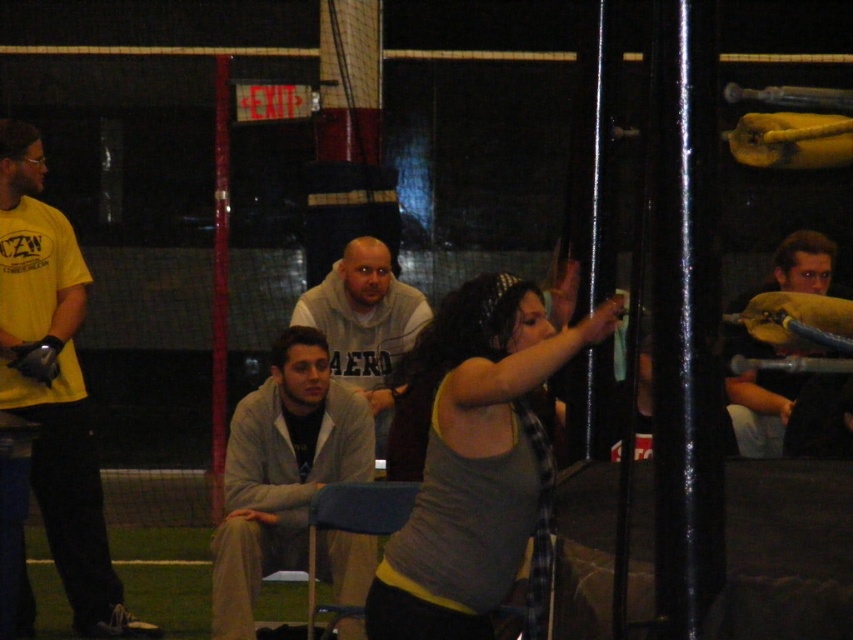
You are a photographer positioned at the back of the sports facility. You want to take a photo of the gray tank top at center and the yellow matte shirt at left. Which subject will appear larger in your photo?

The gray tank top at center will appear larger in the photo because it is closer to the viewer than the yellow matte shirt at left.